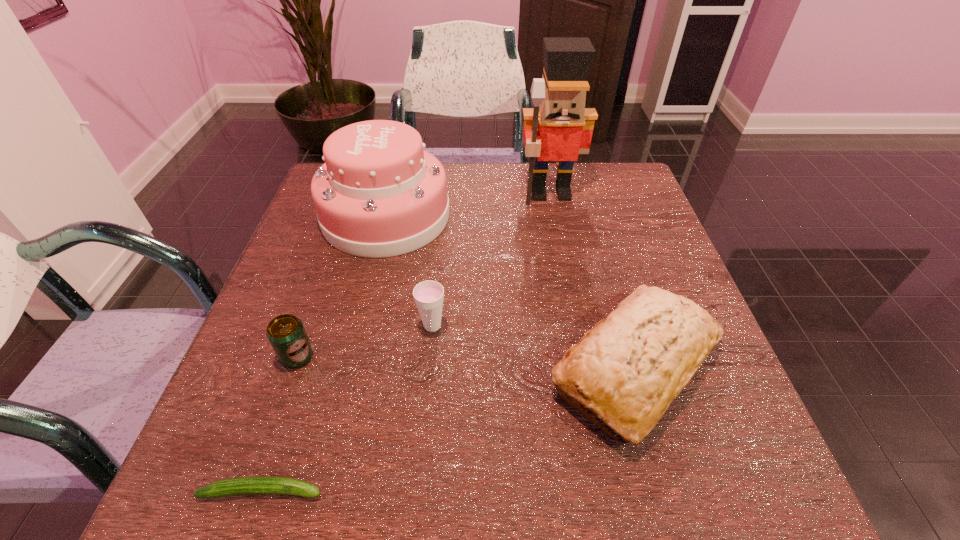
In order to click on free spot at the near right corner of the desktop in this screenshot , I will do `click(748, 489)`.

Where is `vacant space that is in between the cake and the cup`? The image size is (960, 540). vacant space that is in between the cake and the cup is located at coordinates (409, 271).

Where is `free space between the cake and the beer can`? The width and height of the screenshot is (960, 540). free space between the cake and the beer can is located at coordinates (342, 286).

Where is `free space between the cake and the nearest object`? free space between the cake and the nearest object is located at coordinates (324, 353).

Locate an element on the screen. The height and width of the screenshot is (540, 960). unoccupied area between the beer can and the shortest object is located at coordinates (280, 423).

Where is `free space between the beer can and the cake`? The image size is (960, 540). free space between the beer can and the cake is located at coordinates (342, 286).

This screenshot has width=960, height=540. What are the coordinates of `free space that is in between the tallest object and the fourth shortest object` in the screenshot? It's located at (592, 281).

Locate an element on the screen. free point between the tallest object and the shortest object is located at coordinates (406, 342).

The image size is (960, 540). I want to click on free point between the bread and the beer can, so click(467, 362).

The width and height of the screenshot is (960, 540). What are the coordinates of `free space between the bread and the zucchini` in the screenshot? It's located at (448, 429).